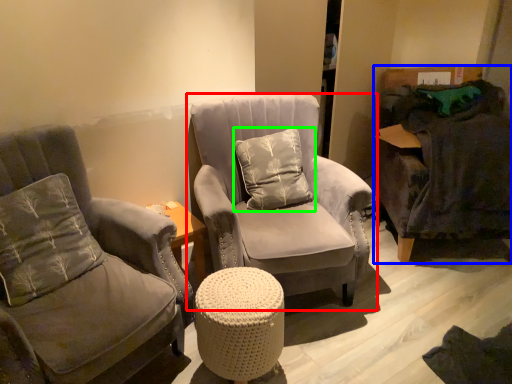
Question: Which object is the closest to the chair (highlighted by a red box)? Choose among these: swivel chair (highlighted by a blue box) or pillow (highlighted by a green box).

Choices:
 (A) swivel chair
 (B) pillow

Answer: (B)